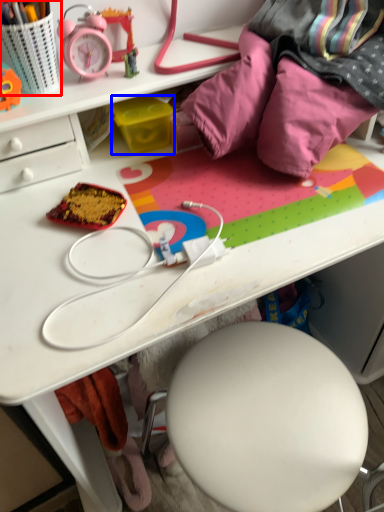
Question: Which object is further to the camera taking this photo, stationery (highlighted by a red box) or stationery (highlighted by a blue box)?

Choices:
 (A) stationery
 (B) stationery

Answer: (B)